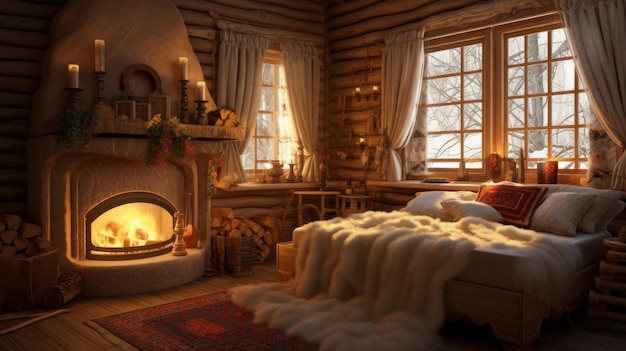
You are a GUI agent. You are given a task and a screenshot of the screen. Output one action in this format:
    pyautogui.click(x=<x>, y=<y>)
    Task: Click on the covers
    Image resolution: width=626 pixels, height=351 pixels.
    Given the screenshot: What is the action you would take?
    click(x=398, y=247)